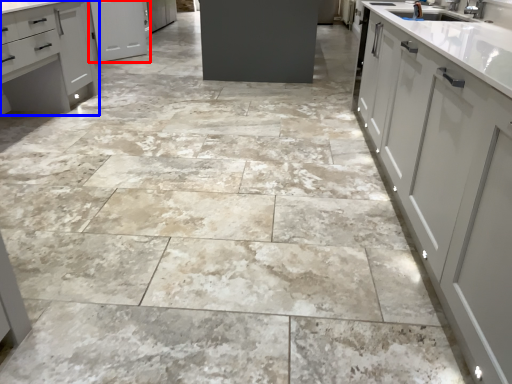
Question: Which object appears farthest to the camera in this image, cabinetry (highlighted by a red box) or cabinetry (highlighted by a blue box)?

Choices:
 (A) cabinetry
 (B) cabinetry

Answer: (A)